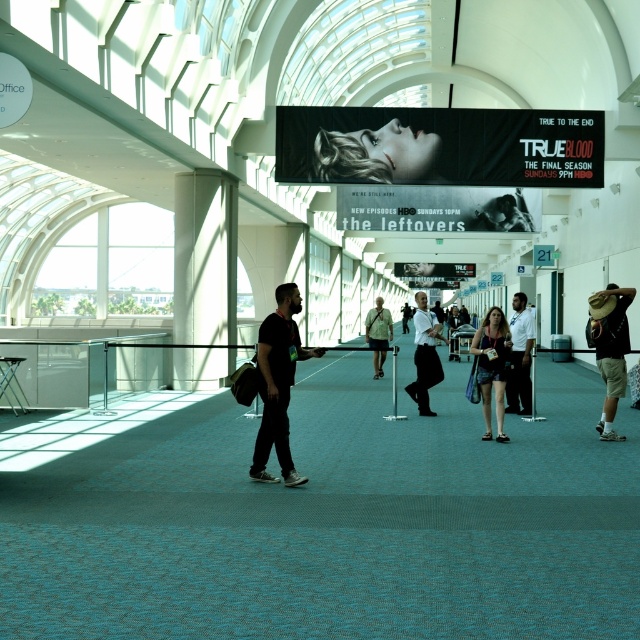
Question: Does white glossy pillar at left appear on the left side of black matte shirt at center?

Choices:
 (A) yes
 (B) no

Answer: (A)

Question: Which of the following is the closest to the observer?

Choices:
 (A) (618, 352)
 (B) (268, 392)

Answer: (B)

Question: Considering the relative positions of black matte shirt at center and denim dress at center in the image provided, where is black matte shirt at center located with respect to denim dress at center?

Choices:
 (A) right
 (B) left

Answer: (B)

Question: Which object is closer to the camera taking this photo?

Choices:
 (A) white glossy pillar at left
 (B) light beige fabric bag at center

Answer: (B)

Question: Can you confirm if white glossy pillar at left is positioned above white cotton shirt at center?

Choices:
 (A) yes
 (B) no

Answer: (A)

Question: Which is farther from the blonde hair at upper center?

Choices:
 (A) matte black hat at right
 (B) white glossy pillar at left
 (C) black matte shirt at center

Answer: (C)